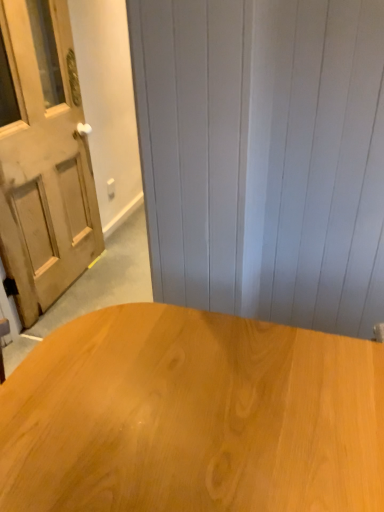
The image size is (384, 512). Describe the element at coordinates (45, 161) in the screenshot. I see `wooden door at left` at that location.

Measure the distance between point (28, 311) and camera.

Point (28, 311) and camera are 6.92 feet apart from each other.

Image resolution: width=384 pixels, height=512 pixels. I want to click on wooden door at left, so click(x=45, y=161).

This screenshot has width=384, height=512. In order to click on wooden door at left in this screenshot , I will do `click(45, 161)`.